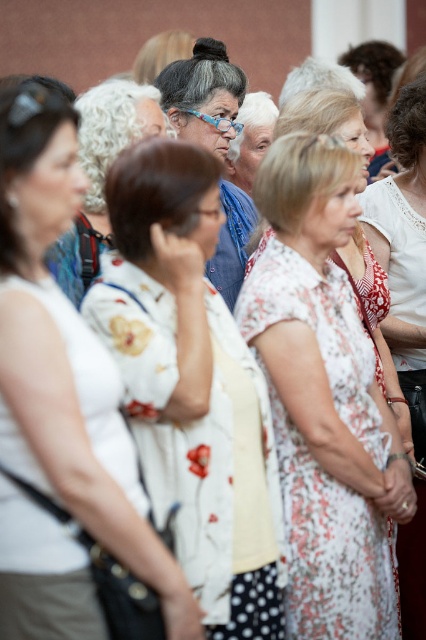
Is point (298, 292) behind point (224, 99)?

No, it is not.

Which is above, floral dress at center or matte blue glasses at center?

Positioned higher is matte blue glasses at center.

Is point (290, 612) farther from camera compared to point (219, 236)?

That is False.

At what (x,y) coordinates should I click in order to perform the action: click on floral dress at center. Please return your answer as a coordinate pair (x, y). The height and width of the screenshot is (640, 426). Looking at the image, I should click on (322, 397).

Does white floral dress at center appear over matte blue glasses at center?

No.

The image size is (426, 640). Find the location of `white floral dress at center`. white floral dress at center is located at coordinates (80, 452).

Does floral fabric dress at center have a larger size compared to matte blue glasses at center?

Yes, floral fabric dress at center is bigger than matte blue glasses at center.

Can you confirm if floral fabric dress at center is taller than matte blue glasses at center?

Yes.

Between point (193, 515) and point (196, 65), which one is positioned in front?

Positioned in front is point (193, 515).

I want to click on floral fabric dress at center, so click(192, 385).